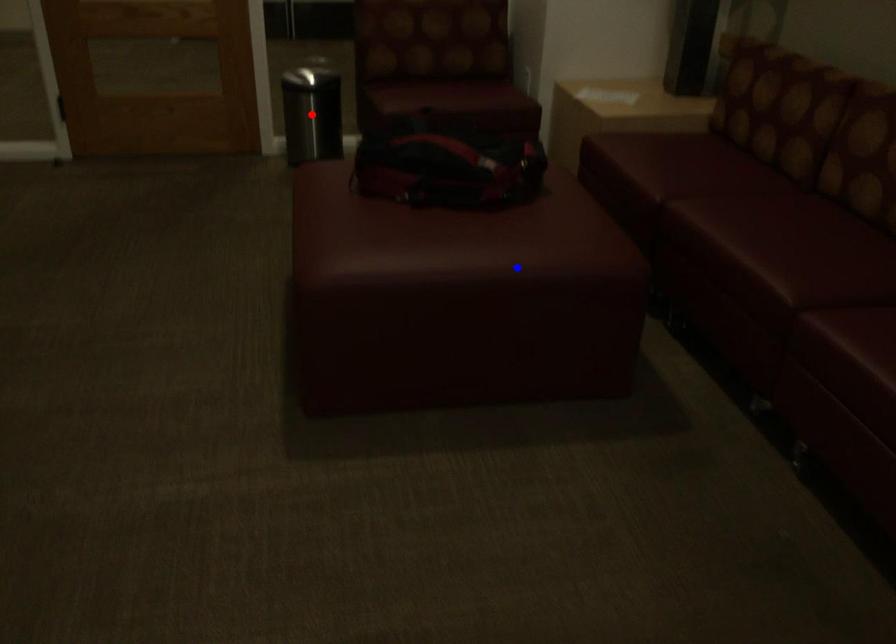
Question: Two points are marked on the image. Which point is closer to the camera?

Choices:
 (A) Blue point is closer.
 (B) Red point is closer.

Answer: (A)